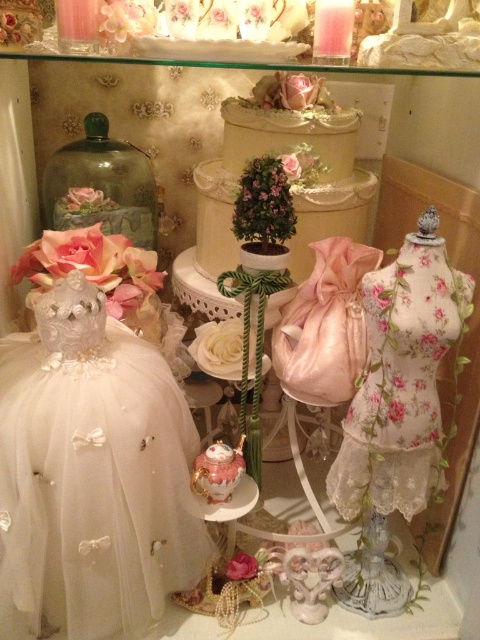
Which of these two, white tulle dress at left or floral lace dress at center, stands shorter?

floral lace dress at center is shorter.

Between point (50, 541) and point (404, 307), which one is positioned in front?

Point (50, 541) is in front.

Is point (167, 513) closer to camera compared to point (376, 291)?

No, (167, 513) is behind (376, 291).

Find the location of a particular element. white tulle dress at left is located at coordinates pos(93,488).